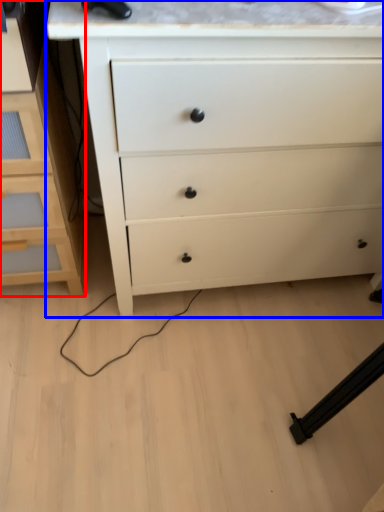
Question: Which of the following is the closest to the observer, chest of drawers (highlighted by a red box) or chest of drawers (highlighted by a blue box)?

Choices:
 (A) chest of drawers
 (B) chest of drawers

Answer: (B)